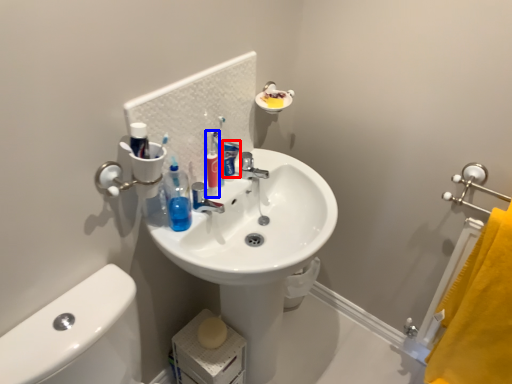
Question: Among these objects, which one is nearest to the camera, toothpaste (highlighted by a red box) or cleaning product (highlighted by a blue box)?

Choices:
 (A) toothpaste
 (B) cleaning product

Answer: (B)